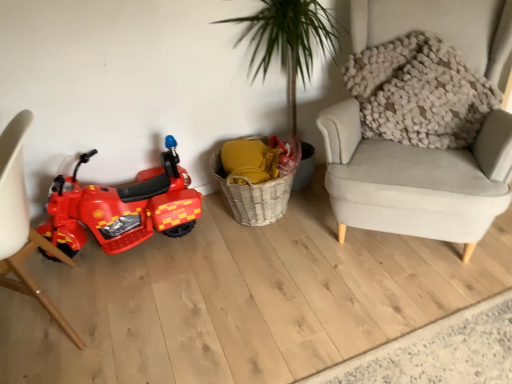
This screenshot has height=384, width=512. In order to click on vacant area located to the right-hand side of shiny plastic toy motorcycle at left in this screenshot , I will do `click(218, 255)`.